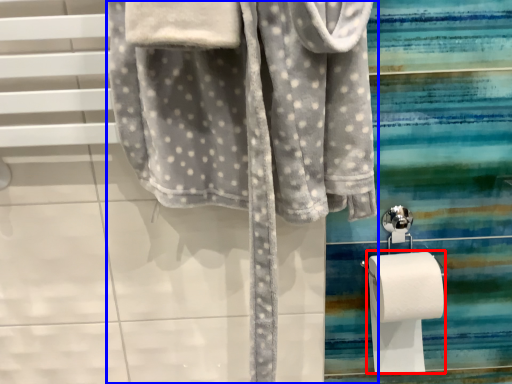
Question: Among these objects, which one is farthest to the camera, toilet paper (highlighted by a red box) or towel (highlighted by a blue box)?

Choices:
 (A) toilet paper
 (B) towel

Answer: (A)